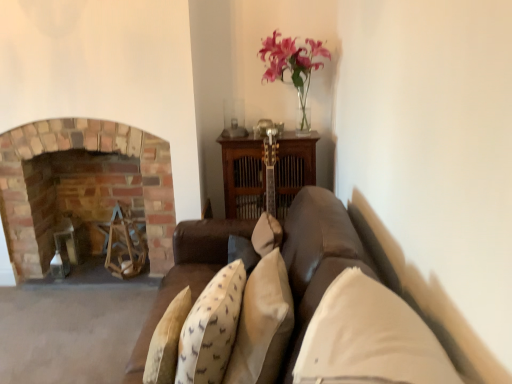
Question: Can you confirm if beige fabric pillow at center, placed as the 1th pillow when sorted from left to right, is bigger than white fabric pillow at center, which is the second pillow in left-to-right order?

Choices:
 (A) yes
 (B) no

Answer: (A)

Question: Is beige fabric pillow at center, placed as the 1th pillow when sorted from left to right, positioned with its back to white fabric pillow at center, which ranks as the first pillow in right-to-left order?

Choices:
 (A) yes
 (B) no

Answer: (B)

Question: Is beige fabric pillow at center, placed as the 1th pillow when sorted from left to right, smaller than white fabric pillow at center, which is the second pillow in left-to-right order?

Choices:
 (A) yes
 (B) no

Answer: (B)

Question: Is beige fabric pillow at center, the 2th pillow from the right, completely or partially outside of white fabric pillow at center, which is the second pillow in left-to-right order?

Choices:
 (A) no
 (B) yes

Answer: (B)

Question: Is beige fabric pillow at center, placed as the 1th pillow when sorted from left to right, touching white fabric pillow at center, which is the second pillow in left-to-right order?

Choices:
 (A) yes
 (B) no

Answer: (B)

Question: Would you say brick fireplace at left is inside or outside white fabric pillow at center, which ranks as the first pillow in right-to-left order?

Choices:
 (A) outside
 (B) inside

Answer: (A)

Question: Is brick fireplace at left wider or thinner than white fabric pillow at center, which ranks as the first pillow in right-to-left order?

Choices:
 (A) thin
 (B) wide

Answer: (B)

Question: From a real-world perspective, is brick fireplace at left positioned above or below white fabric pillow at center, which is the second pillow in left-to-right order?

Choices:
 (A) below
 (B) above

Answer: (A)

Question: From the image's perspective, is brick fireplace at left located above or below white fabric pillow at center, which ranks as the first pillow in right-to-left order?

Choices:
 (A) below
 (B) above

Answer: (B)

Question: Considering their positions, is beige fabric pillow at center, the 2th pillow from the right, located in front of or behind white fabric pillow at center, which ranks as the first pillow in right-to-left order?

Choices:
 (A) behind
 (B) front

Answer: (A)

Question: Is beige fabric pillow at center, the 2th pillow from the right, inside the boundaries of white fabric pillow at center, which is the second pillow in left-to-right order, or outside?

Choices:
 (A) inside
 (B) outside

Answer: (B)

Question: Looking at their shapes, would you say beige fabric pillow at center, placed as the 1th pillow when sorted from left to right, is wider or thinner than white fabric pillow at center, which is the second pillow in left-to-right order?

Choices:
 (A) thin
 (B) wide

Answer: (A)

Question: From the image's perspective, is beige fabric pillow at center, the 2th pillow from the right, located above or below white fabric pillow at center, which ranks as the first pillow in right-to-left order?

Choices:
 (A) below
 (B) above

Answer: (A)

Question: From the image's perspective, is white fabric pillow at center, which ranks as the first pillow in right-to-left order, above or below brick fireplace at left?

Choices:
 (A) below
 (B) above

Answer: (A)

Question: Considering the relative positions of white fabric pillow at center, which is the second pillow in left-to-right order, and brick fireplace at left in the image provided, is white fabric pillow at center, which is the second pillow in left-to-right order, to the left or to the right of brick fireplace at left?

Choices:
 (A) left
 (B) right

Answer: (B)